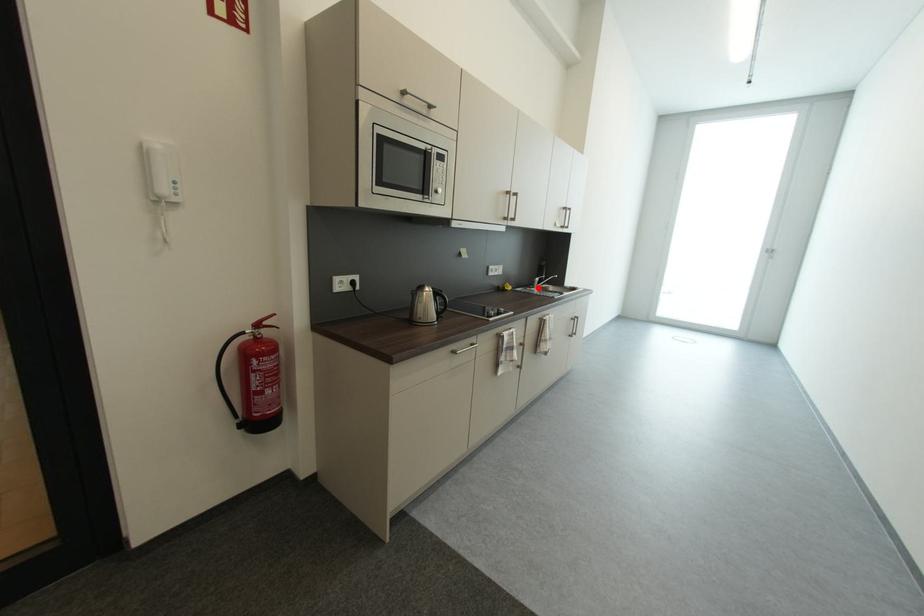
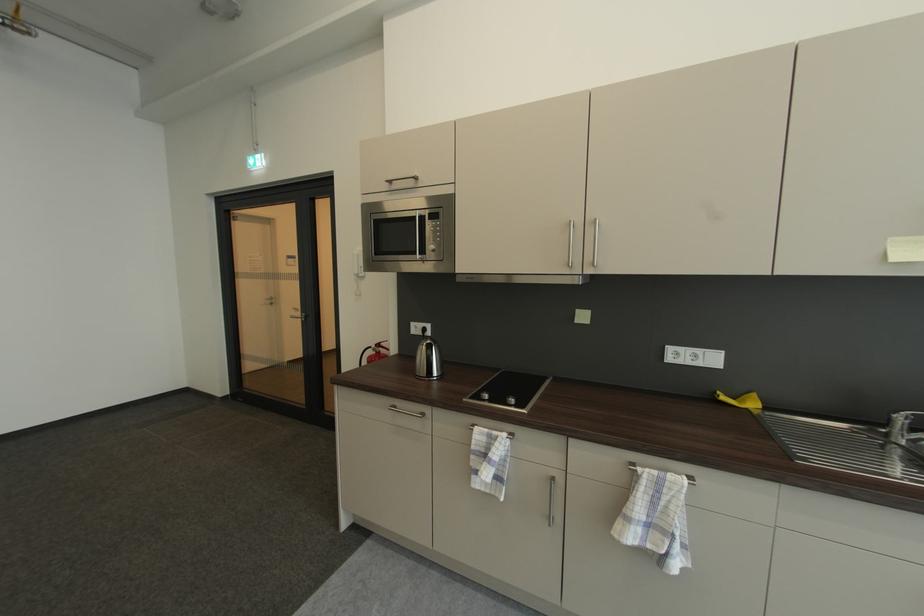
In the second image, find the point that corresponds to the highlighted location in the first image.

(892, 432)